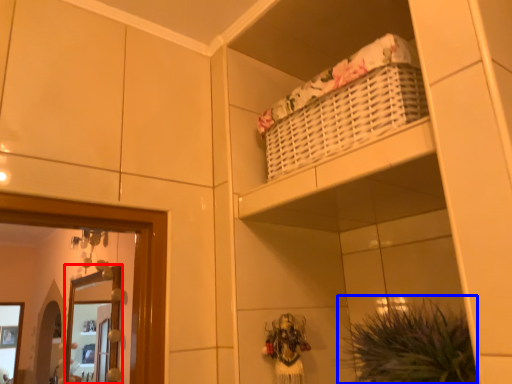
Question: Which point is further to the camera, mirror (highlighted by a red box) or plant (highlighted by a blue box)?

Choices:
 (A) mirror
 (B) plant

Answer: (A)